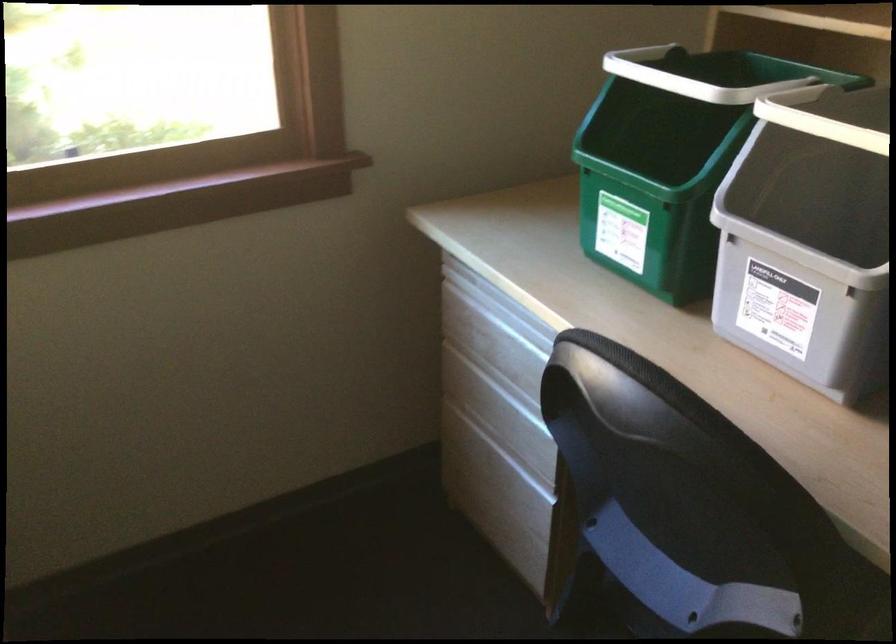
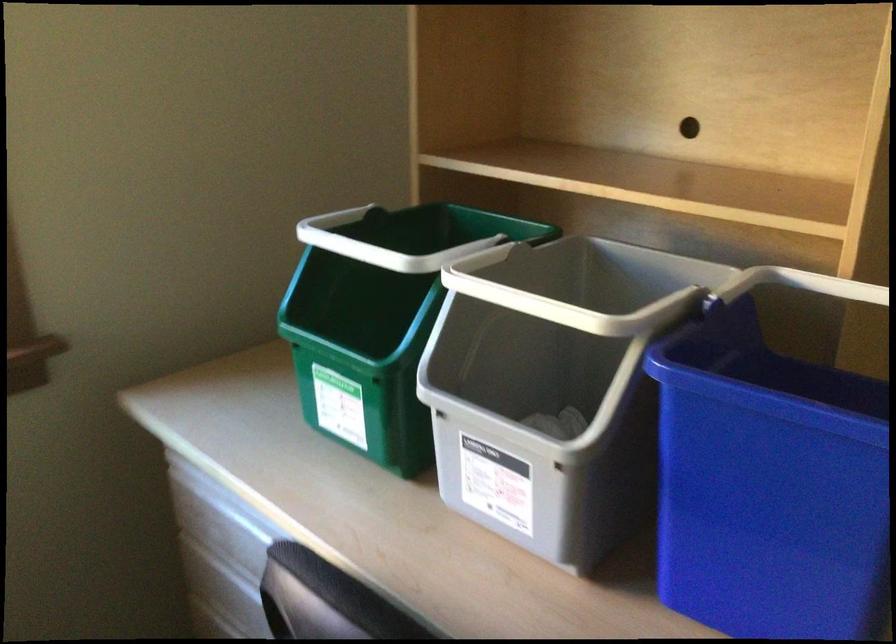
Question: The camera is either moving clockwise (left) or counter-clockwise (right) around the object. The first image is from the beginning of the video and the second image is from the end. Is the camera moving left or right when shooting the video?

Choices:
 (A) Left
 (B) Right

Answer: (A)